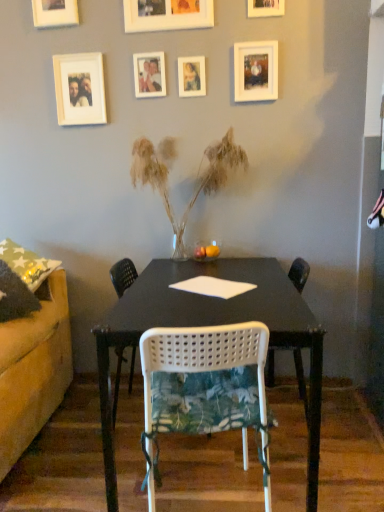
Question: Is white matte picture frame at upper center, which appears as the sixth picture frame when viewed from the left, outside translucent glass vase with dried grass at center?

Choices:
 (A) yes
 (B) no

Answer: (A)

Question: Is white matte picture frame at upper center, which appears as the sixth picture frame when viewed from the left, positioned behind translucent glass vase with dried grass at center?

Choices:
 (A) yes
 (B) no

Answer: (A)

Question: Is white matte picture frame at upper center, which ranks as the second picture frame in right-to-left order, to the left of translucent glass vase with dried grass at center from the viewer's perspective?

Choices:
 (A) yes
 (B) no

Answer: (B)

Question: From the image's perspective, is white matte picture frame at upper center, which ranks as the second picture frame in right-to-left order, located beneath translucent glass vase with dried grass at center?

Choices:
 (A) no
 (B) yes

Answer: (A)

Question: Does white matte picture frame at upper center, which ranks as the second picture frame in right-to-left order, have a greater height compared to translucent glass vase with dried grass at center?

Choices:
 (A) yes
 (B) no

Answer: (B)

Question: Considering their positions, is white matte picture frame at upper left, arranged as the second picture frame when viewed from the left, located in front of or behind matte wooden picture frame at upper center, placed as the fifth picture frame when sorted from left to right?

Choices:
 (A) behind
 (B) front

Answer: (A)

Question: From their relative heights in the image, would you say white matte picture frame at upper left, which ranks as the sixth picture frame in right-to-left order, is taller or shorter than matte wooden picture frame at upper center, the 3th picture frame when ordered from right to left?

Choices:
 (A) short
 (B) tall

Answer: (B)

Question: From a real-world perspective, is white matte picture frame at upper left, arranged as the second picture frame when viewed from the left, positioned above or below matte wooden picture frame at upper center, the 3th picture frame when ordered from right to left?

Choices:
 (A) above
 (B) below

Answer: (B)

Question: Based on their sizes in the image, would you say white matte picture frame at upper left, which ranks as the sixth picture frame in right-to-left order, is bigger or smaller than matte wooden picture frame at upper center, placed as the fifth picture frame when sorted from left to right?

Choices:
 (A) big
 (B) small

Answer: (A)

Question: Is point (162, 77) positioned closer to the camera than point (281, 0)?

Choices:
 (A) closer
 (B) farther

Answer: (B)

Question: In the image, is matte white photo frame at upper center, which is the 3th picture frame from left to right, positioned in front of or behind wooden picture frame at upper center, which is the 1th picture frame in right-to-left order?

Choices:
 (A) front
 (B) behind

Answer: (B)

Question: Based on their sizes in the image, would you say matte white photo frame at upper center, marked as the fifth picture frame in a right-to-left arrangement, is bigger or smaller than wooden picture frame at upper center, which is the 1th picture frame in right-to-left order?

Choices:
 (A) big
 (B) small

Answer: (A)

Question: From the image's perspective, is matte white photo frame at upper center, marked as the fifth picture frame in a right-to-left arrangement, positioned above or below wooden picture frame at upper center, which is the 1th picture frame in right-to-left order?

Choices:
 (A) below
 (B) above

Answer: (A)

Question: In terms of size, does green floral fabric chair at center, which is counted as the second chair, starting from the back, appear bigger or smaller than white matte picture frame at upper left, arranged as the second picture frame when viewed from the left?

Choices:
 (A) big
 (B) small

Answer: (A)

Question: Considering the positions of point (203, 413) and point (69, 54), is point (203, 413) closer or farther from the camera than point (69, 54)?

Choices:
 (A) closer
 (B) farther

Answer: (A)